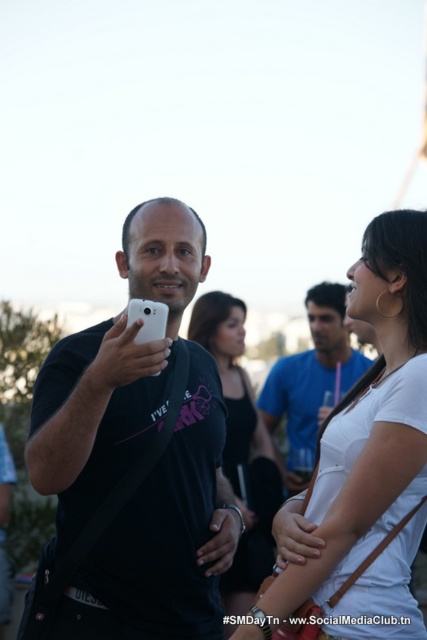
Question: Based on their relative distances, which object is nearer to the matte black t-shirt at center?

Choices:
 (A) matte black shirt at center
 (B) white cotton shirt at center

Answer: (A)

Question: Which point appears farthest from the camera in this image?

Choices:
 (A) (306, 458)
 (B) (98, 493)
 (C) (228, 611)
 (D) (327, 564)

Answer: (A)

Question: Is white cotton shirt at center wider than matte black t-shirt at center?

Choices:
 (A) no
 (B) yes

Answer: (A)

Question: Which point is farther from the camera taking this photo?

Choices:
 (A) pyautogui.click(x=99, y=342)
 (B) pyautogui.click(x=356, y=394)

Answer: (A)

Question: Can you confirm if white cotton shirt at center is wider than matte black t-shirt at center?

Choices:
 (A) yes
 (B) no

Answer: (B)

Question: Considering the relative positions of white matte phone at center and white cotton shirt at center in the image provided, where is white matte phone at center located with respect to white cotton shirt at center?

Choices:
 (A) above
 (B) below

Answer: (A)